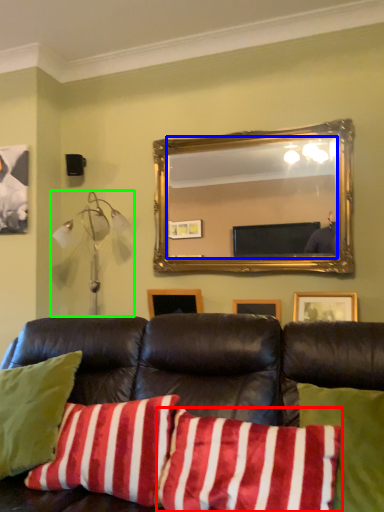
Question: Which object is positioned farthest from pillow (highlighted by a red box)? Select from mirror (highlighted by a blue box) and lamp (highlighted by a green box).

Choices:
 (A) mirror
 (B) lamp

Answer: (A)